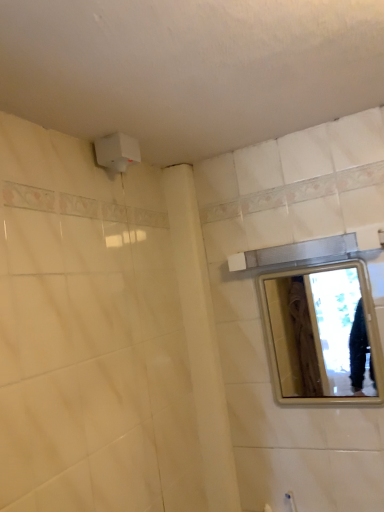
In order to face white glossy mirror at upper right, should I rotate leftwards or rightwards?

To face it directly, rotate right by 16.178 degrees.

Image resolution: width=384 pixels, height=512 pixels. Describe the element at coordinates (323, 335) in the screenshot. I see `white glossy mirror at upper right` at that location.

Locate an element on the screen. Image resolution: width=384 pixels, height=512 pixels. white glossy mirror at upper right is located at coordinates (323, 335).

Image resolution: width=384 pixels, height=512 pixels. Identify the location of white glossy mirror at upper right. tap(323, 335).